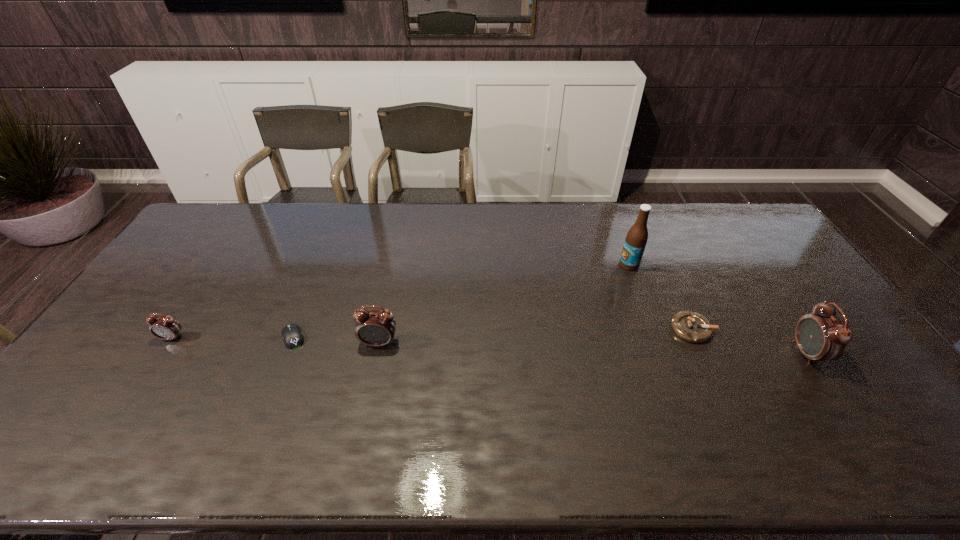
Identify the location of vacant space positioned on the face of the fourth shortest object. The height and width of the screenshot is (540, 960). (370, 387).

Locate an element on the screen. The image size is (960, 540). free space located 0.070m on the face of the rightmost alarm clock is located at coordinates (771, 354).

You are a GUI agent. You are given a task and a screenshot of the screen. Output one action in this format:
    pyautogui.click(x=<x>, y=<y>)
    Task: Click on the free location located on the face of the rightmost alarm clock
    The height and width of the screenshot is (540, 960).
    Given the screenshot: What is the action you would take?
    pyautogui.click(x=661, y=354)

Locate an element on the screen. The width and height of the screenshot is (960, 540). vacant region located 0.130m on the face of the rightmost alarm clock is located at coordinates (750, 354).

You are a GUI agent. You are given a task and a screenshot of the screen. Output one action in this format:
    pyautogui.click(x=<x>, y=<y>)
    Task: Click on the blank space located 0.240m on the back of the tallest object
    
    Given the screenshot: What is the action you would take?
    coord(612,217)

Where is `vacant point located on the back of the second object from left to right`? vacant point located on the back of the second object from left to right is located at coordinates (316, 280).

The width and height of the screenshot is (960, 540). I want to click on free location located on the back of the fifth object from left to right, so click(x=678, y=298).

At what (x,y) coordinates should I click in order to perform the action: click on object that is at the left edge. Please return your answer as a coordinate pair (x, y). The image size is (960, 540). Looking at the image, I should click on (164, 327).

Locate an element on the screen. The width and height of the screenshot is (960, 540). object that is at the right edge is located at coordinates (821, 336).

I want to click on free spot at the far edge of the desktop, so 310,218.